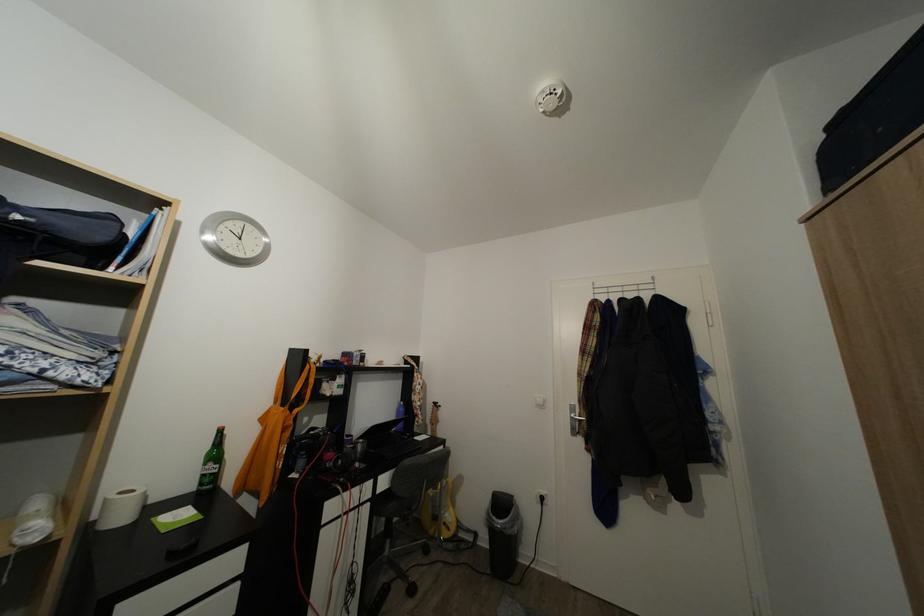
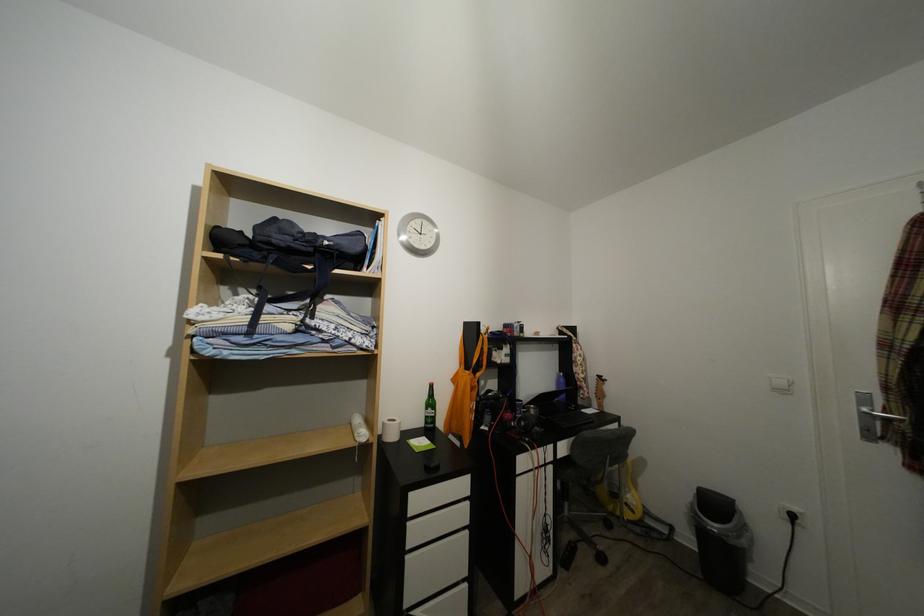
Question: The camera is either moving clockwise (left) or counter-clockwise (right) around the object. The first image is from the beginning of the video and the second image is from the end. Is the camera moving left or right when shooting the video?

Choices:
 (A) Left
 (B) Right

Answer: (B)